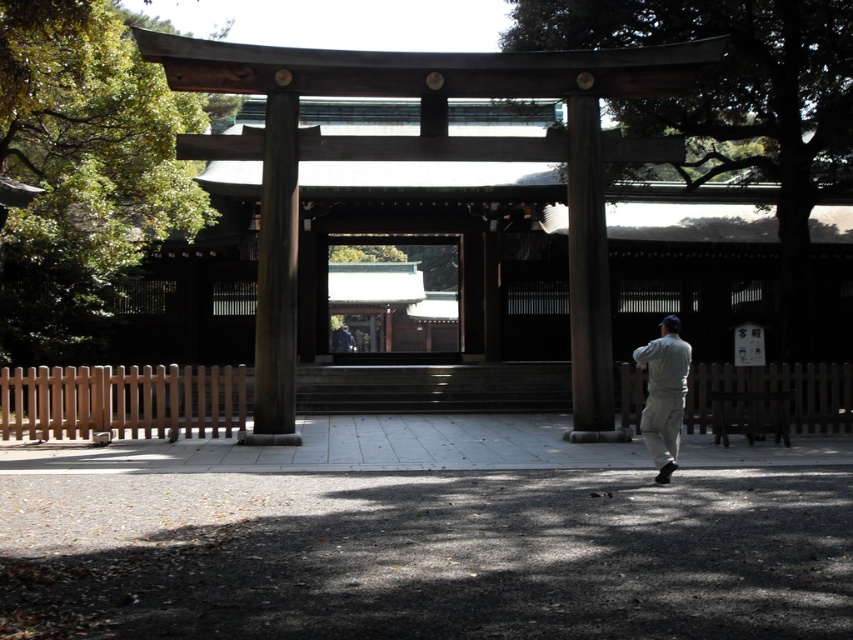
Question: Among these objects, which one is nearest to the camera?

Choices:
 (A) gray fabric pants at right
 (B) matte gray jacket at center

Answer: (A)

Question: Which object appears farthest from the camera in this image?

Choices:
 (A) matte gray jacket at center
 (B) gray fabric pants at right
 (C) green tile roof at center

Answer: (A)

Question: In this image, where is smooth wood pillar at center located relative to matte gray jacket at center?

Choices:
 (A) below
 (B) above

Answer: (B)

Question: Is smooth brown pillar at center further to camera compared to gray fabric pants at right?

Choices:
 (A) no
 (B) yes

Answer: (B)

Question: Can you confirm if gray fabric pants at right is bigger than matte gray jacket at center?

Choices:
 (A) no
 (B) yes

Answer: (A)

Question: Among these objects, which one is nearest to the camera?

Choices:
 (A) smooth brown pillar at center
 (B) green tile roof at center

Answer: (A)